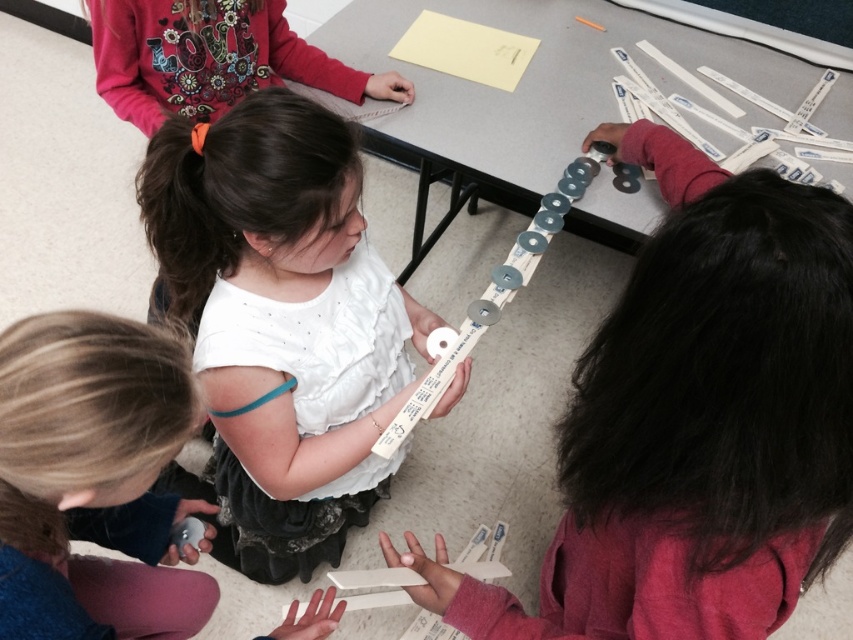
Can you confirm if white matte tape measure at center is positioned above white paper at center?

Actually, white matte tape measure at center is below white paper at center.

Is point (317, 513) closer to viewer compared to point (457, 173)?

Yes.

Where is `white matte tape measure at center`? white matte tape measure at center is located at coordinates (277, 323).

Based on the photo, is white matte paper strip at upper center bigger than white paper at center?

Actually, white matte paper strip at upper center might be smaller than white paper at center.

Between point (628, 570) and point (387, 150), which one is positioned in front?

Point (628, 570)

Locate an element on the screen. white matte paper strip at upper center is located at coordinates (695, 435).

Who is higher up, white matte paper strip at upper center or white matte tape measure at center?

white matte tape measure at center

Is point (726, 308) positioned in front of point (154, 316)?

Yes, point (726, 308) is in front of point (154, 316).

Does point (715, 273) come in front of point (329, 221)?

Yes.

This screenshot has height=640, width=853. I want to click on white matte paper strip at upper center, so click(x=695, y=435).